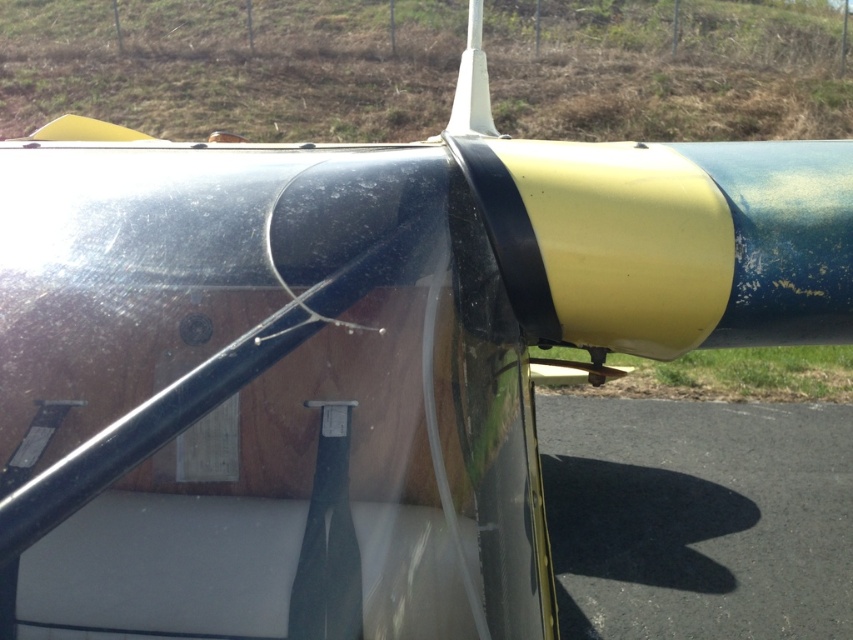
You are a pilot inspecting an aircraft wing. You notice a point marked at coordinates (233, 65) on the wing. What is located at this point?

The point at coordinates (233, 65) marks dry grass at upper center.

You are a pilot inspecting the aircraft wing and notice dry grass at upper center and black asphalt at lower right. Which object is located to the left of the other?

The dry grass at upper center is positioned on the left side of black asphalt at lower right.

You are a drone operator preparing to land your drone on the area shown in the image. You have two options for landing spots based on the objects present. The first option is near the dry grass at upper center, and the second is near the black asphalt at lower right. Considering the height difference between these two areas, which landing spot is more elevated?

The dry grass at upper center has a greater height compared to the black asphalt at lower right, so the landing spot near the dry grass at upper center is more elevated.